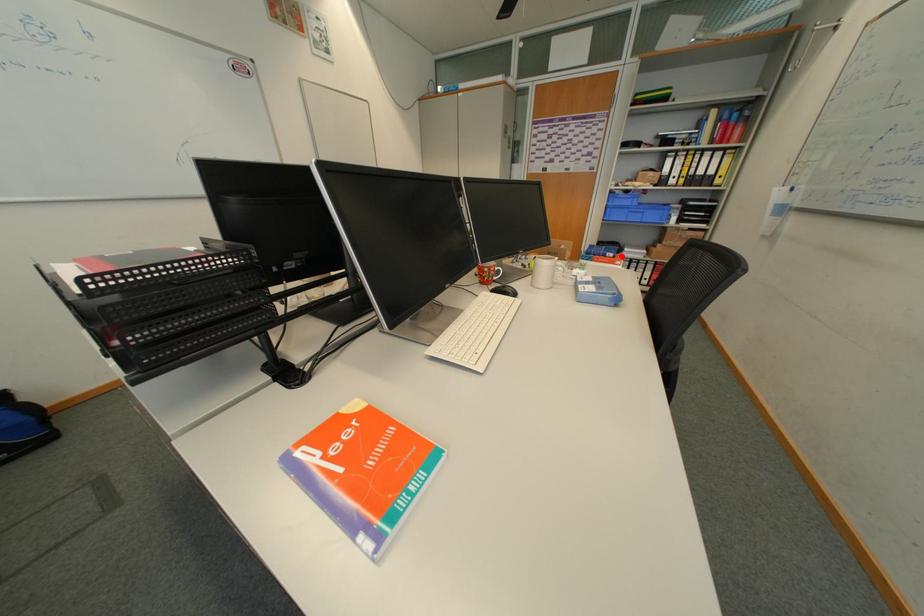
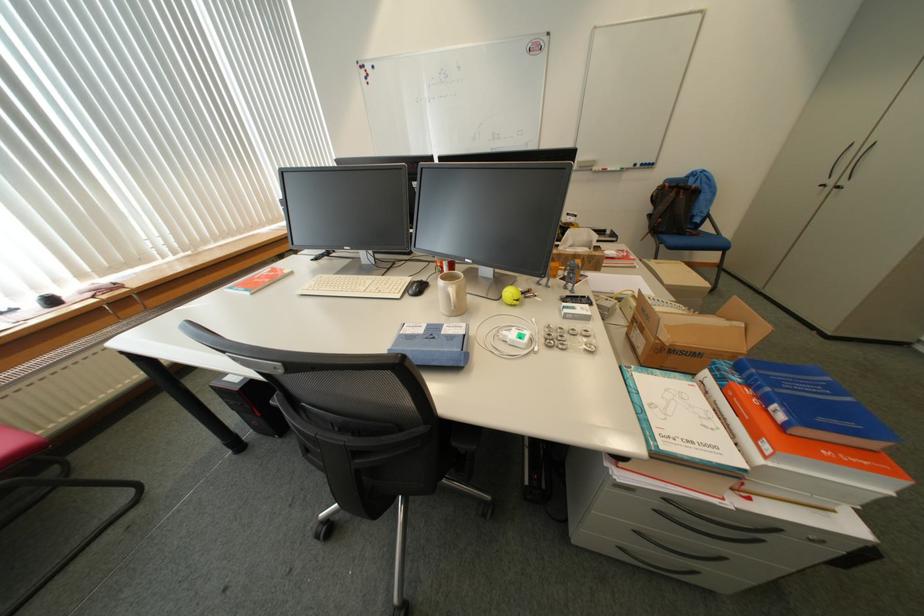
Find the pixel in the second image that matches the highlighted location in the first image.

(791, 418)